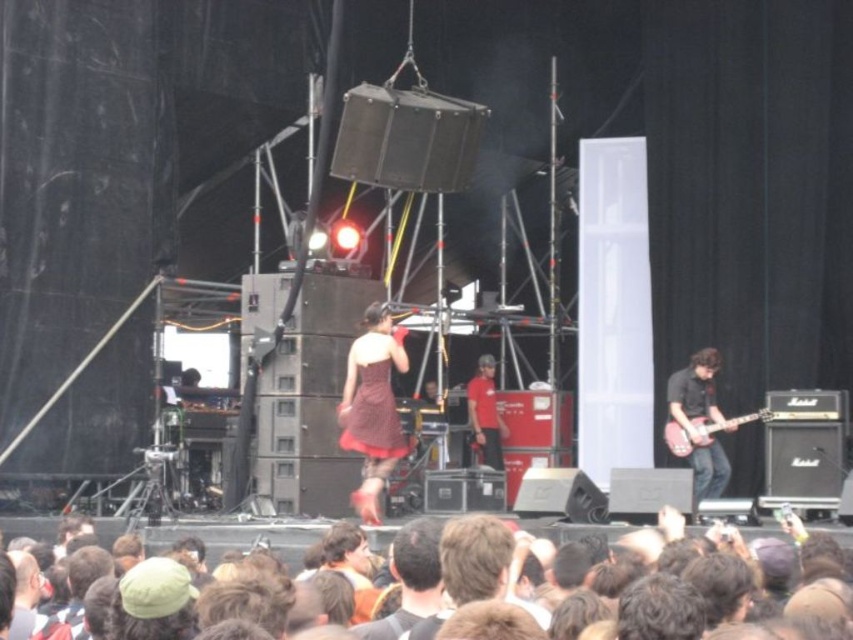
You are a photographer standing at the back of the venue, and you want to take a clear photo of the burgundy satin dress at center. The camera you have can focus on objects up to 35 meters away. Do you think your camera will be able to capture the dress clearly?

The burgundy satin dress at center is 37.46 meters away from viewer. Since the camera can only focus up to 35 meters, it will not be able to capture the dress clearly.

You are a photographer at the concert and want to take a photo that includes both the shiny black guitar at right and the red smooth shirt at center. Which object should you focus on first to ensure both are in sharp focus?

The shiny black guitar at right is closer to the viewer than the red smooth shirt at center. To ensure both are in sharp focus, focus on the shiny black guitar at right first, as it is closer, and use a smaller aperture for a deeper depth of field.